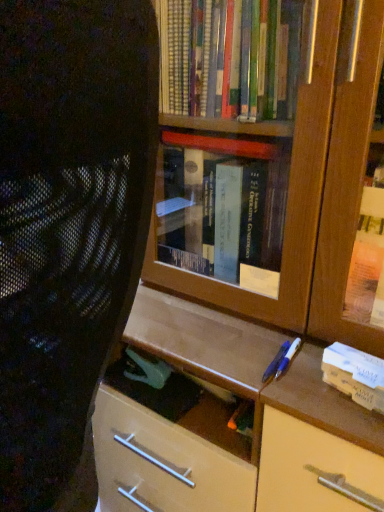
Question: Is black mesh chair at left to the left or to the right of white cardboard book at right in the image?

Choices:
 (A) left
 (B) right

Answer: (A)

Question: Is point (74, 510) closer or farther from the camera than point (355, 355)?

Choices:
 (A) closer
 (B) farther

Answer: (B)

Question: Considering the positions of black mesh chair at left and white cardboard book at right in the image, is black mesh chair at left bigger or smaller than white cardboard book at right?

Choices:
 (A) small
 (B) big

Answer: (B)

Question: From their relative heights in the image, would you say white cardboard book at right is taller or shorter than black mesh chair at left?

Choices:
 (A) tall
 (B) short

Answer: (B)

Question: Based on their positions, is white cardboard book at right located to the left or right of black mesh chair at left?

Choices:
 (A) right
 (B) left

Answer: (A)

Question: Is point (380, 404) positioned closer to the camera than point (57, 266)?

Choices:
 (A) farther
 (B) closer

Answer: (A)

Question: Is white cardboard book at right inside or outside of black mesh chair at left?

Choices:
 (A) inside
 (B) outside

Answer: (B)